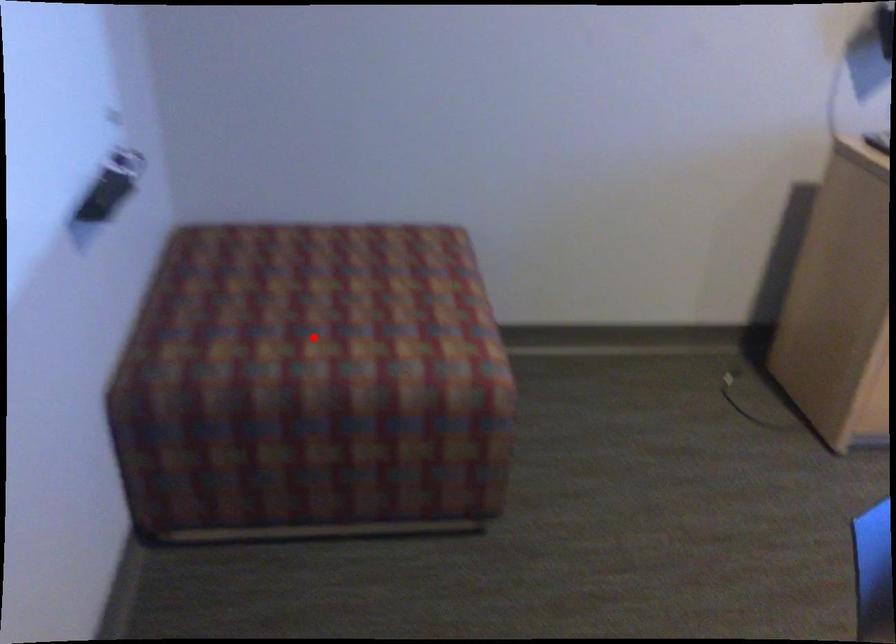
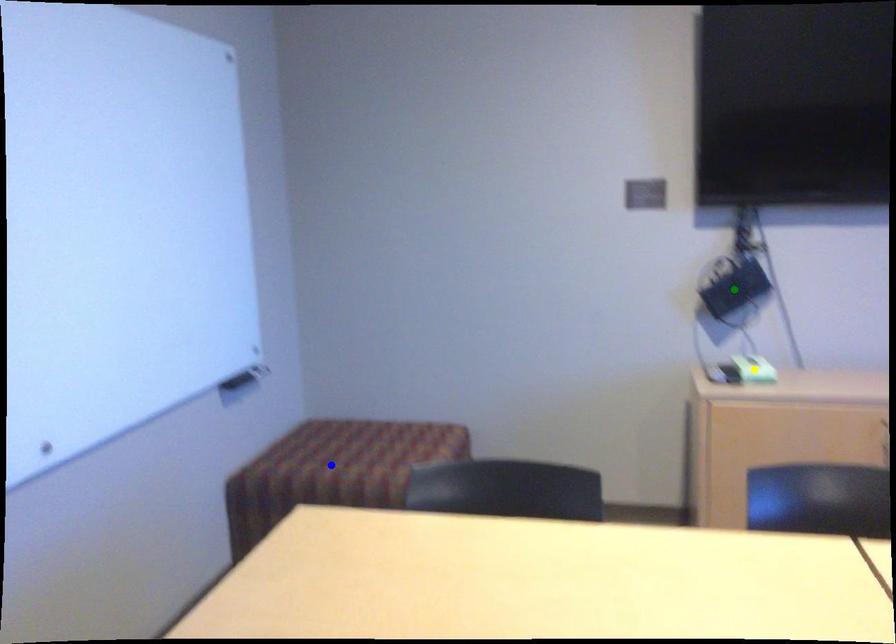
Question: I am providing you with two images of the same scene from different viewpoints. A red point is marked on the first image. You are given multiple points on the second image. Can you choose the point in image 2 that corresponds to the point in image 1?

Choices:
 (A) blue point
 (B) green point
 (C) yellow point

Answer: (A)